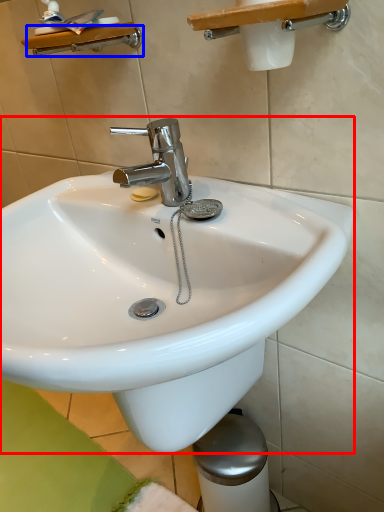
Question: Among these objects, which one is farthest to the camera, sink (highlighted by a red box) or shower (highlighted by a blue box)?

Choices:
 (A) sink
 (B) shower

Answer: (B)